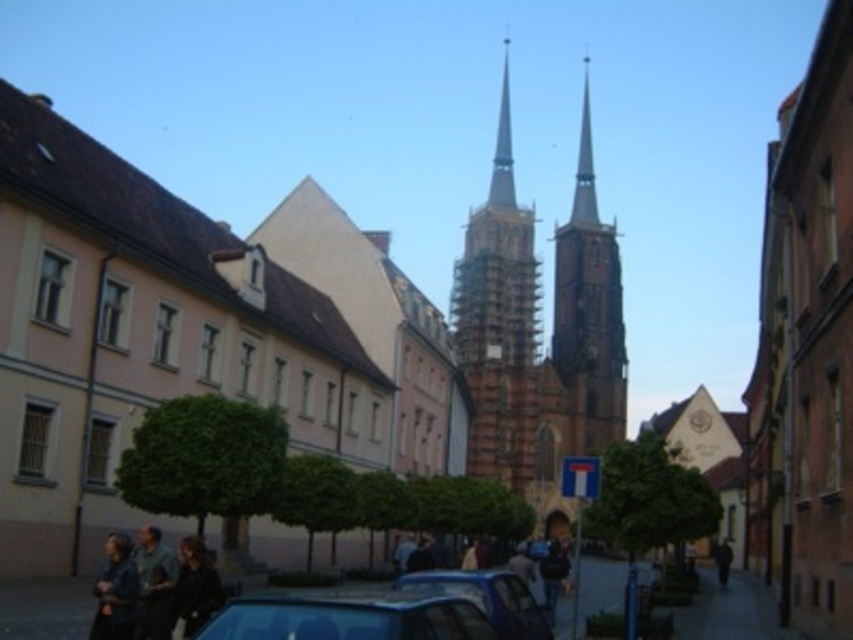
Question: Which is farther from the blue glossy car at center?

Choices:
 (A) dark gray jacket at center
 (B) dark blue denim jacket at lower left

Answer: (A)

Question: Is blue glossy car at center wider than metallic blue car at lower center?

Choices:
 (A) no
 (B) yes

Answer: (B)

Question: From the image, what is the correct spatial relationship of brown stone church at center in relation to brown wooden tower at center?

Choices:
 (A) right
 (B) left

Answer: (A)

Question: Which object is farther from the camera taking this photo?

Choices:
 (A) dark gray jacket at center
 (B) brown wooden tower at center
 (C) blue glossy car at center

Answer: (B)

Question: Can you confirm if brown stone church at center is wider than dark blue shirt at lower left?

Choices:
 (A) yes
 (B) no

Answer: (A)

Question: Which of these objects is positioned closest to the dark blue jeans at center?

Choices:
 (A) brown stone church at center
 (B) dark blue shirt at lower left
 (C) metallic blue car at lower center
 (D) brown wooden tower at center

Answer: (C)